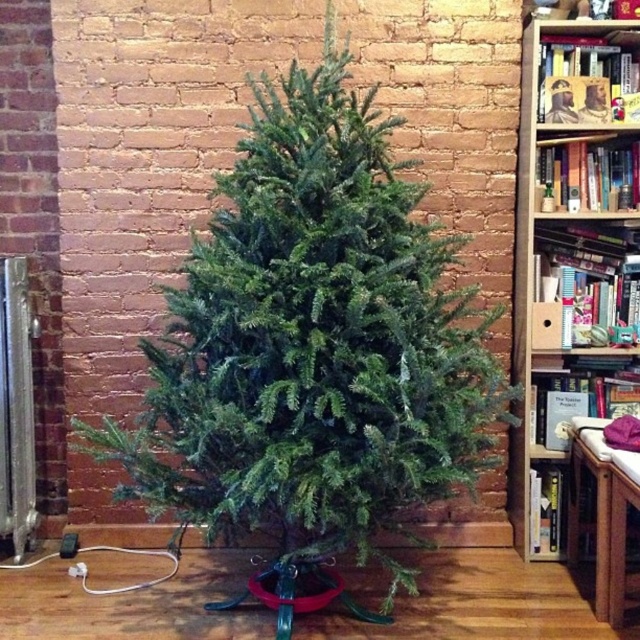
Between green matte christmas tree at center and wooden bookshelf at right, which one appears on the right side from the viewer's perspective?

From the viewer's perspective, wooden bookshelf at right appears more on the right side.

Is green matte christmas tree at center positioned behind wooden bookshelf at right?

That is False.

Does point (403, 353) come closer to viewer compared to point (532, 29)?

Yes, point (403, 353) is closer to viewer.

Where is `green matte christmas tree at center`? green matte christmas tree at center is located at coordinates (312, 348).